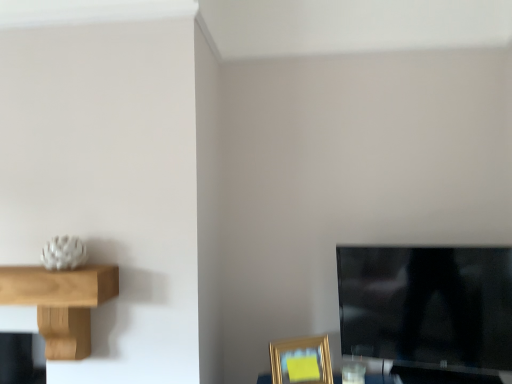
Question: Considering the relative positions of gold metallic picture frame at lower right and black glossy tv at lower right in the image provided, is gold metallic picture frame at lower right in front of black glossy tv at lower right?

Choices:
 (A) yes
 (B) no

Answer: (B)

Question: From the image's perspective, does gold metallic picture frame at lower right appear lower than black glossy tv at lower right?

Choices:
 (A) yes
 (B) no

Answer: (A)

Question: From a real-world perspective, does gold metallic picture frame at lower right stand above black glossy tv at lower right?

Choices:
 (A) yes
 (B) no

Answer: (B)

Question: Does gold metallic picture frame at lower right come behind black glossy tv at lower right?

Choices:
 (A) yes
 (B) no

Answer: (A)

Question: Is black glossy tv at lower right inside gold metallic picture frame at lower right?

Choices:
 (A) yes
 (B) no

Answer: (B)

Question: Is light brown wooden shelf at left taller or shorter than gold metallic picture frame at lower right?

Choices:
 (A) short
 (B) tall

Answer: (B)

Question: Would you say light brown wooden shelf at left is inside or outside gold metallic picture frame at lower right?

Choices:
 (A) outside
 (B) inside

Answer: (A)

Question: Based on their sizes in the image, would you say light brown wooden shelf at left is bigger or smaller than gold metallic picture frame at lower right?

Choices:
 (A) big
 (B) small

Answer: (A)

Question: Is light brown wooden shelf at left wider or thinner than gold metallic picture frame at lower right?

Choices:
 (A) wide
 (B) thin

Answer: (A)

Question: Considering the positions of black glossy tv at lower right and gold metallic picture frame at lower right in the image, is black glossy tv at lower right bigger or smaller than gold metallic picture frame at lower right?

Choices:
 (A) small
 (B) big

Answer: (B)

Question: Is black glossy tv at lower right wider or thinner than gold metallic picture frame at lower right?

Choices:
 (A) wide
 (B) thin

Answer: (A)

Question: Considering the relative positions of black glossy tv at lower right and gold metallic picture frame at lower right in the image provided, is black glossy tv at lower right to the left or to the right of gold metallic picture frame at lower right?

Choices:
 (A) right
 (B) left

Answer: (A)

Question: From a real-world perspective, is black glossy tv at lower right positioned above or below gold metallic picture frame at lower right?

Choices:
 (A) above
 (B) below

Answer: (A)

Question: Considering the positions of gold metallic picture frame at lower right and black glossy tv at lower right in the image, is gold metallic picture frame at lower right taller or shorter than black glossy tv at lower right?

Choices:
 (A) tall
 (B) short

Answer: (B)

Question: Visually, is gold metallic picture frame at lower right positioned to the left or to the right of black glossy tv at lower right?

Choices:
 (A) left
 (B) right

Answer: (A)